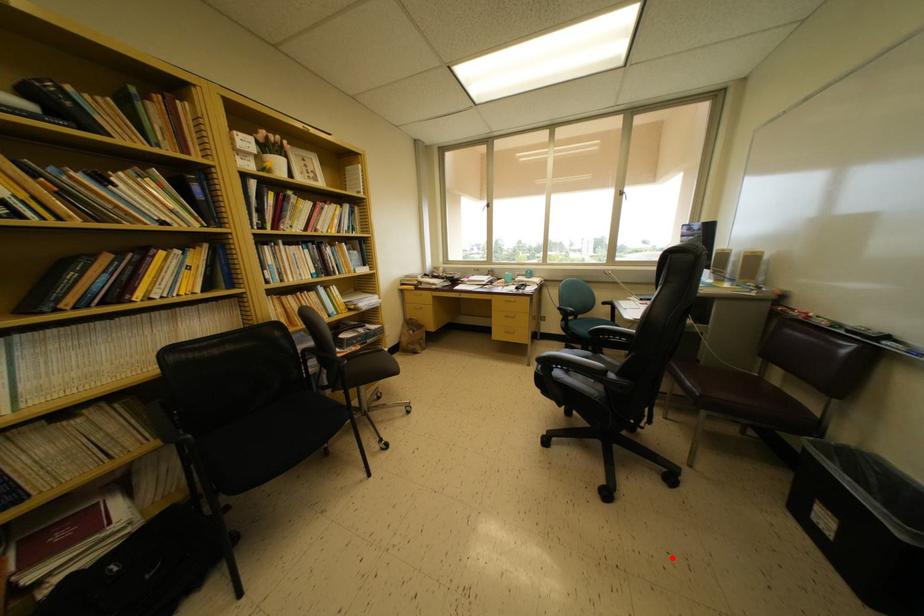
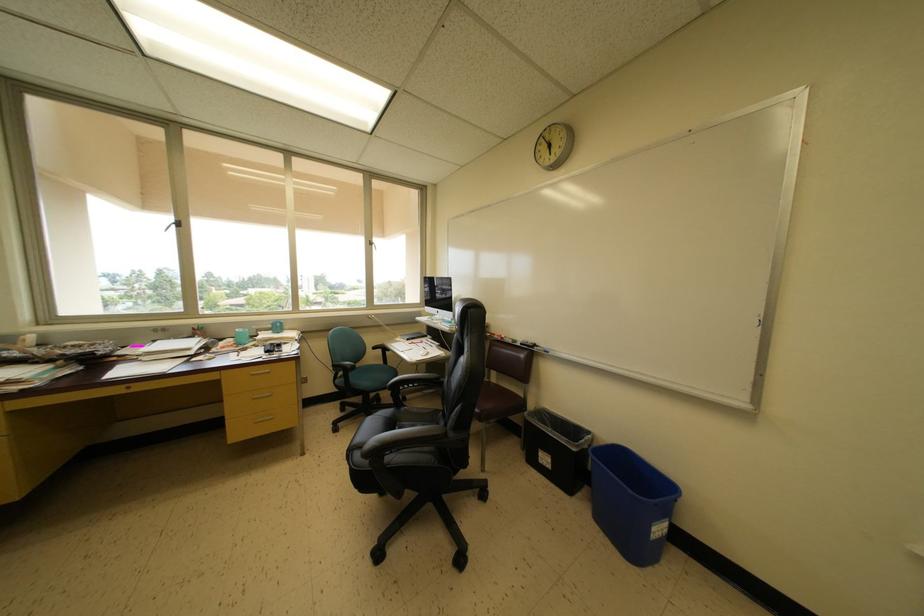
Find the pixel in the second image that matches the highlighted location in the first image.

(520, 573)